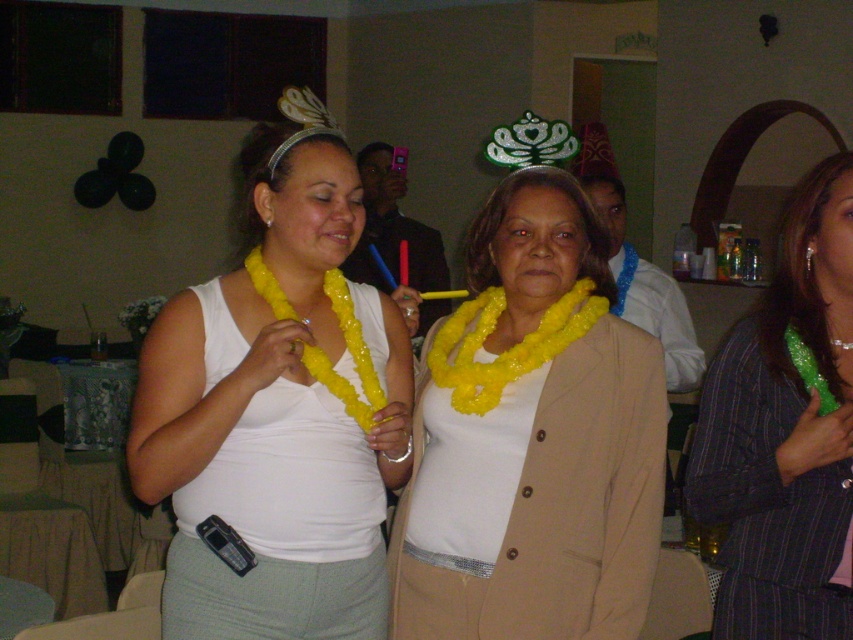
Question: Is white matte tank top at center further to camera compared to yellow beaded lei at center?

Choices:
 (A) no
 (B) yes

Answer: (A)

Question: Which of the following is the closest to the observer?

Choices:
 (A) (577, 525)
 (B) (331, 269)

Answer: (A)

Question: In this image, where is white matte tank top at center located relative to yellow beaded lei at center?

Choices:
 (A) left
 (B) right

Answer: (B)

Question: Which object is positioned farthest from the green glittery necklace at center?

Choices:
 (A) yellow beaded lei at center
 (B) matte yellow necklace at center
 (C) white matte tank top at center

Answer: (A)

Question: Is matte yellow necklace at center behind green glittery necklace at center?

Choices:
 (A) yes
 (B) no

Answer: (A)

Question: Estimate the real-world distances between objects in this image. Which object is farther from the green glittery necklace at center?

Choices:
 (A) matte yellow necklace at center
 (B) white matte tank top at center
 (C) yellow beaded lei at center

Answer: (C)